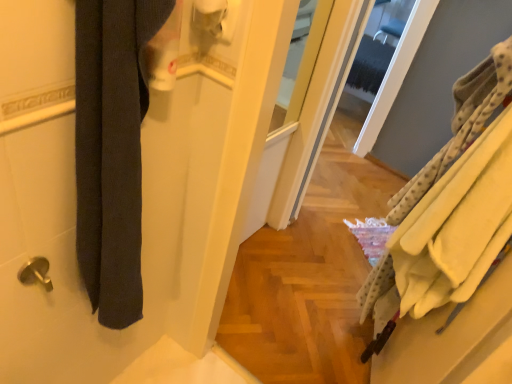
Question: From a real-world perspective, is white matte toilet paper at upper center on top of yellow fleece bath towel at right, placed as the 2th bath towel when sorted from left to right?

Choices:
 (A) no
 (B) yes

Answer: (B)

Question: Is white matte toilet paper at upper center behind yellow fleece bath towel at right, placed as the 2th bath towel when sorted from left to right?

Choices:
 (A) no
 (B) yes

Answer: (A)

Question: Is white matte toilet paper at upper center looking in the opposite direction of yellow fleece bath towel at right, arranged as the first bath towel when viewed from the right?

Choices:
 (A) no
 (B) yes

Answer: (A)

Question: Does white matte toilet paper at upper center come in front of yellow fleece bath towel at right, arranged as the first bath towel when viewed from the right?

Choices:
 (A) no
 (B) yes

Answer: (B)

Question: From the image's perspective, would you say white matte toilet paper at upper center is shown under yellow fleece bath towel at right, arranged as the first bath towel when viewed from the right?

Choices:
 (A) no
 (B) yes

Answer: (A)

Question: From the image's perspective, is white matte toilet paper at upper center above yellow fleece bath towel at right, placed as the 2th bath towel when sorted from left to right?

Choices:
 (A) no
 (B) yes

Answer: (B)

Question: Is white matte toilet paper at upper center oriented towards dark gray fabric at left, marked as the second bath towel in a right-to-left arrangement?

Choices:
 (A) no
 (B) yes

Answer: (B)

Question: From a real-world perspective, does white matte toilet paper at upper center sit lower than dark gray fabric at left, marked as the 1th bath towel in a left-to-right arrangement?

Choices:
 (A) no
 (B) yes

Answer: (A)

Question: Is white matte toilet paper at upper center wider than dark gray fabric at left, marked as the 1th bath towel in a left-to-right arrangement?

Choices:
 (A) no
 (B) yes

Answer: (A)

Question: Can dark gray fabric at left, marked as the second bath towel in a right-to-left arrangement, be found inside white matte toilet paper at upper center?

Choices:
 (A) no
 (B) yes

Answer: (A)

Question: Considering the relative positions of white matte toilet paper at upper center and dark gray fabric at left, marked as the 1th bath towel in a left-to-right arrangement, in the image provided, is white matte toilet paper at upper center behind dark gray fabric at left, marked as the 1th bath towel in a left-to-right arrangement,?

Choices:
 (A) no
 (B) yes

Answer: (B)

Question: Can you confirm if white matte toilet paper at upper center is bigger than dark gray fabric at left, marked as the 1th bath towel in a left-to-right arrangement?

Choices:
 (A) yes
 (B) no

Answer: (B)

Question: Can we say dark gray fabric at left, marked as the second bath towel in a right-to-left arrangement, lies outside yellow fleece bath towel at right, arranged as the first bath towel when viewed from the right?

Choices:
 (A) no
 (B) yes

Answer: (B)